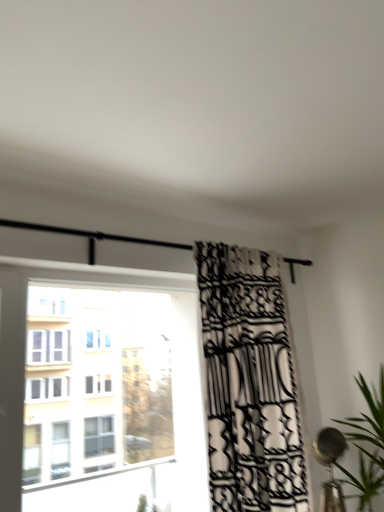
Question: Is black and white patterned curtain at center positioned with its back to transparent glass window at left?

Choices:
 (A) no
 (B) yes

Answer: (A)

Question: Does black and white patterned curtain at center have a lesser height compared to transparent glass window at left?

Choices:
 (A) no
 (B) yes

Answer: (A)

Question: From the image's perspective, is black and white patterned curtain at center on top of transparent glass window at left?

Choices:
 (A) no
 (B) yes

Answer: (B)

Question: Is the depth of black and white patterned curtain at center greater than that of transparent glass window at left?

Choices:
 (A) no
 (B) yes

Answer: (B)

Question: Is transparent glass window at left inside black and white patterned curtain at center?

Choices:
 (A) no
 (B) yes

Answer: (A)

Question: From a real-world perspective, is black and white patterned curtain at center below transparent glass window at left?

Choices:
 (A) yes
 (B) no

Answer: (B)

Question: From the image's perspective, is green leafy plant at right under transparent glass window at left?

Choices:
 (A) no
 (B) yes

Answer: (B)

Question: Does green leafy plant at right have a lesser width compared to transparent glass window at left?

Choices:
 (A) yes
 (B) no

Answer: (B)

Question: From a real-world perspective, is green leafy plant at right positioned over transparent glass window at left based on gravity?

Choices:
 (A) yes
 (B) no

Answer: (B)

Question: Is green leafy plant at right positioned beyond the bounds of transparent glass window at left?

Choices:
 (A) no
 (B) yes

Answer: (B)

Question: Is green leafy plant at right turned away from transparent glass window at left?

Choices:
 (A) yes
 (B) no

Answer: (B)

Question: Can you confirm if green leafy plant at right is wider than transparent glass window at left?

Choices:
 (A) no
 (B) yes

Answer: (B)

Question: Is black and white patterned curtain at center looking in the opposite direction of green leafy plant at right?

Choices:
 (A) yes
 (B) no

Answer: (B)